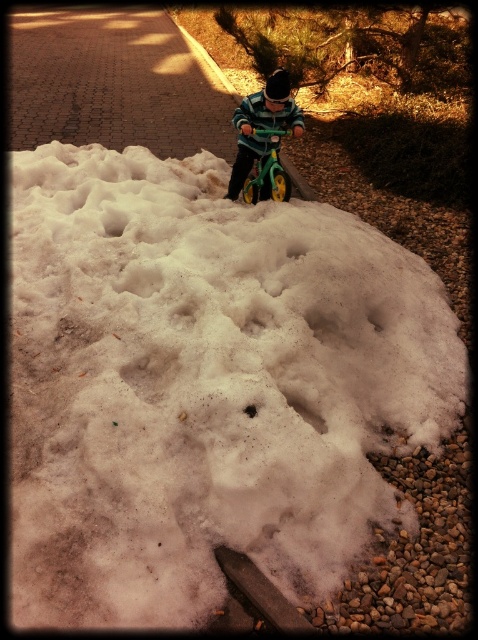
Question: Can you confirm if white fluffy snow at center is smaller than striped sweater at center?

Choices:
 (A) no
 (B) yes

Answer: (A)

Question: Where is white fluffy snow at center located in relation to striped sweater at center in the image?

Choices:
 (A) right
 (B) left

Answer: (B)

Question: Which object is farther from the camera taking this photo?

Choices:
 (A) striped sweater at center
 (B) white fluffy snow at center

Answer: (A)

Question: Among these points, which one is nearest to the camera?

Choices:
 (A) (240, 140)
 (B) (50, 436)

Answer: (B)

Question: Where is white fluffy snow at center located in relation to striped sweater at center in the image?

Choices:
 (A) left
 (B) right

Answer: (A)